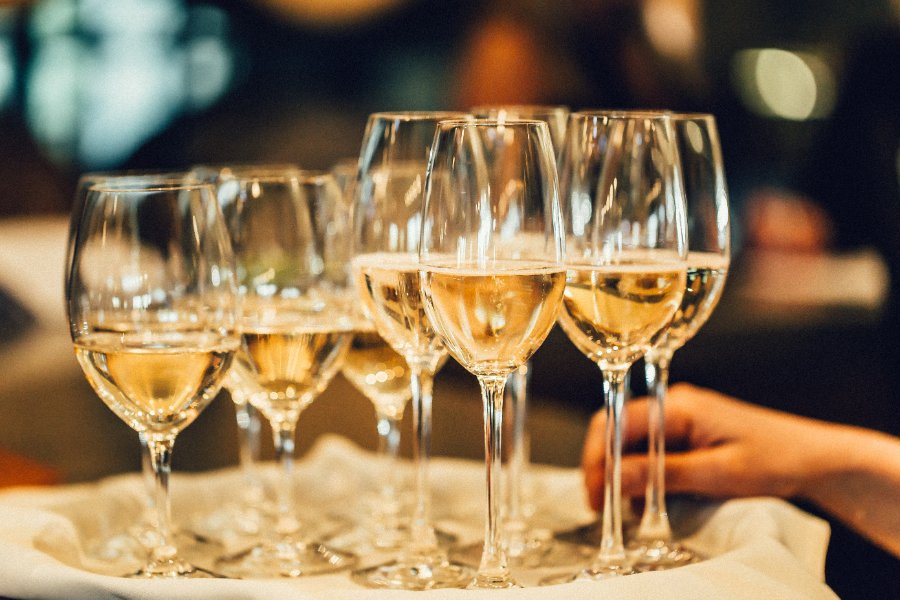
Locate an element on the screen. Image resolution: width=900 pixels, height=600 pixels. glasses of wine is located at coordinates (149, 285), (291, 308), (391, 277), (488, 283), (617, 271), (698, 249), (379, 379).